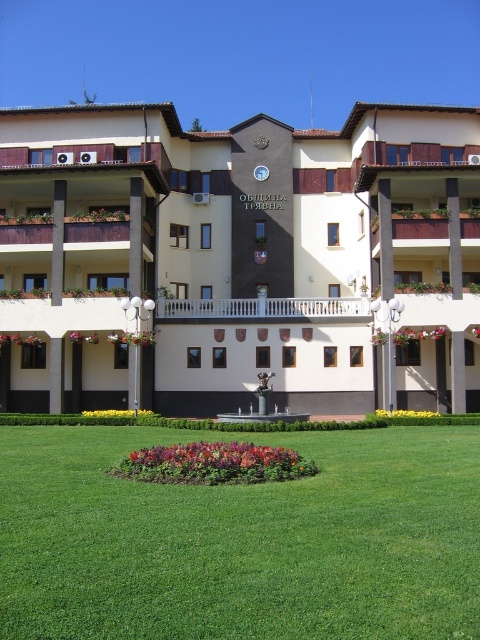
You are standing in front of the multi story building with symmetrical design. You see a point at coordinate (240, 259). What part of the building is this point located on?

The point at coordinate (240, 259) is on the beige concrete building at center.

You are standing on a path that runs through the middle of the image. You see the beige concrete building at center and the green grass at center. Which one is higher up in the image?

The beige concrete building at center is located above the green grass at center, so it is higher up in the image.

You are standing in front of the building and want to determine the relative positions of two points marked on its facade. Which of the two points, point 1 at coordinates [45,218] or point 2 at [127,541], is closer to you?

Point 1 at coordinates [45,218] is closer to you because it is further to the viewer than point 2 at [127,541].